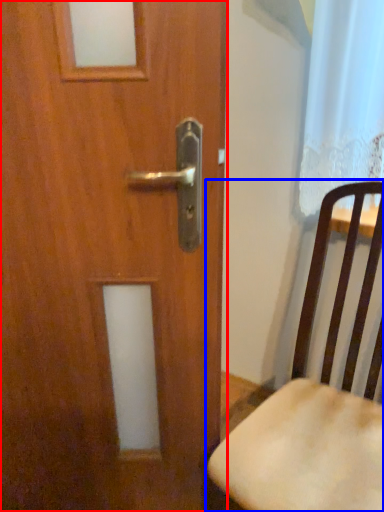
Question: Among these objects, which one is nearest to the camera, door (highlighted by a red box) or chair (highlighted by a blue box)?

Choices:
 (A) door
 (B) chair

Answer: (B)